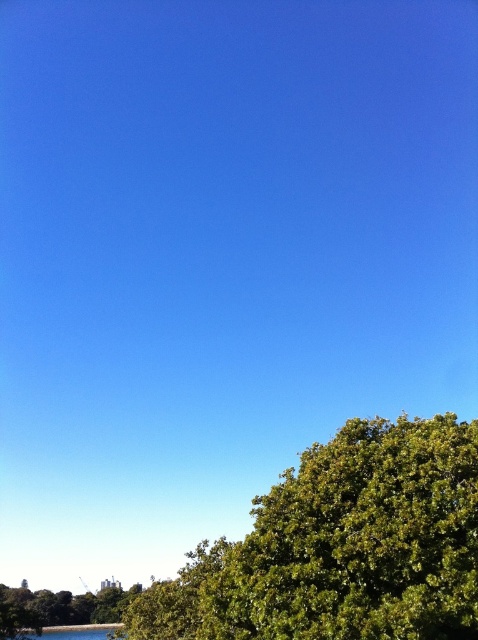
Can you confirm if green leafy tree at lower right is positioned to the right of green leafy tree at lower left?

Correct, you'll find green leafy tree at lower right to the right of green leafy tree at lower left.

Does green leafy tree at lower right come behind green leafy tree at lower left?

That is False.

Where is `green leafy tree at lower right`? green leafy tree at lower right is located at coordinates (341, 547).

The image size is (478, 640). Find the location of `green leafy tree at lower right`. green leafy tree at lower right is located at coordinates (341, 547).